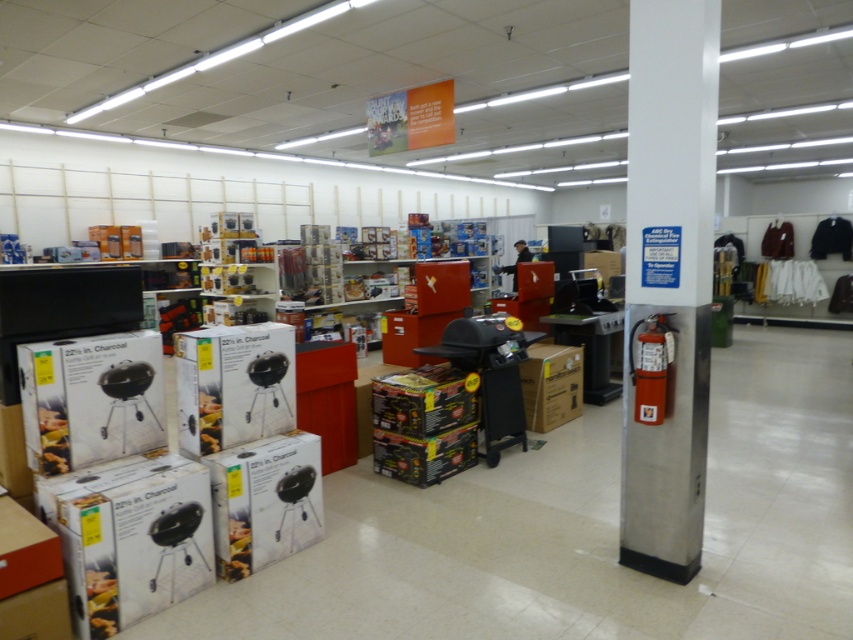
Does point (160, 545) come behind point (270, 323)?

No, (160, 545) is in front of (270, 323).

Which is more to the right, white cardboard box at lower left or white matte grill at lower left?

Positioned to the right is white matte grill at lower left.

Between point (138, 461) and point (276, 348), which one is positioned behind?

The point (276, 348) is behind.

Locate an element on the screen. white cardboard box at lower left is located at coordinates (131, 538).

Who is more distant from viewer, (157,602) or (215,536)?

Positioned behind is point (215,536).

You are a GUI agent. You are given a task and a screenshot of the screen. Output one action in this format:
    pyautogui.click(x=<x>, y=<y>)
    Task: Click on the white cardboard box at lower left
    
    Given the screenshot: What is the action you would take?
    pyautogui.click(x=131, y=538)

Who is more distant from viewer, [206,484] or [219,531]?

The point [219,531] is more distant.

Find the location of a particular element. The height and width of the screenshot is (640, 853). white cardboard box at lower left is located at coordinates (x=131, y=538).

Which of these two, white cardboard box at center or brown cardboard box at center, stands taller?

brown cardboard box at center

Can you confirm if white cardboard box at center is shorter than brown cardboard box at center?

Correct, white cardboard box at center is not as tall as brown cardboard box at center.

The height and width of the screenshot is (640, 853). I want to click on white cardboard box at center, so click(x=264, y=500).

The image size is (853, 640). In order to click on white cardboard box at center in this screenshot , I will do `click(264, 500)`.